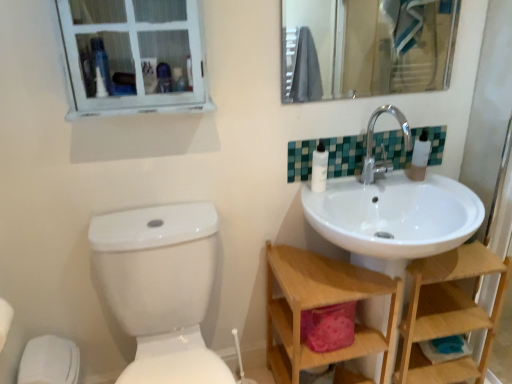
This screenshot has height=384, width=512. I want to click on unoccupied region to the right of white matte toilet paper at upper center, so click(361, 188).